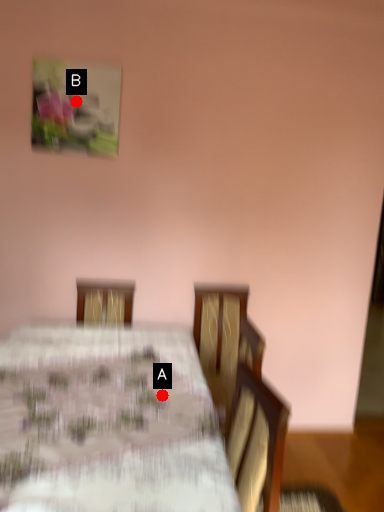
Question: Two points are circled on the image, labeled by A and B beside each circle. Which point appears closest to the camera in this image?

Choices:
 (A) A is closer
 (B) B is closer

Answer: (A)